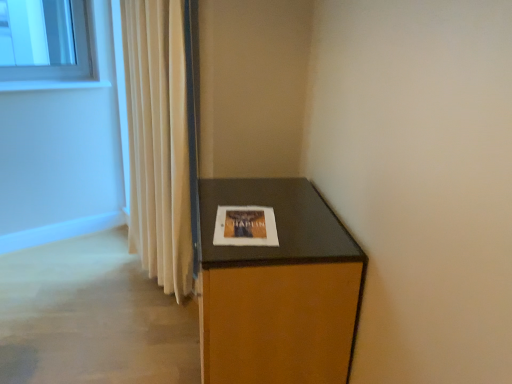
The image size is (512, 384). In order to click on free point behind matte white picture frame at center in this screenshot , I will do `click(245, 196)`.